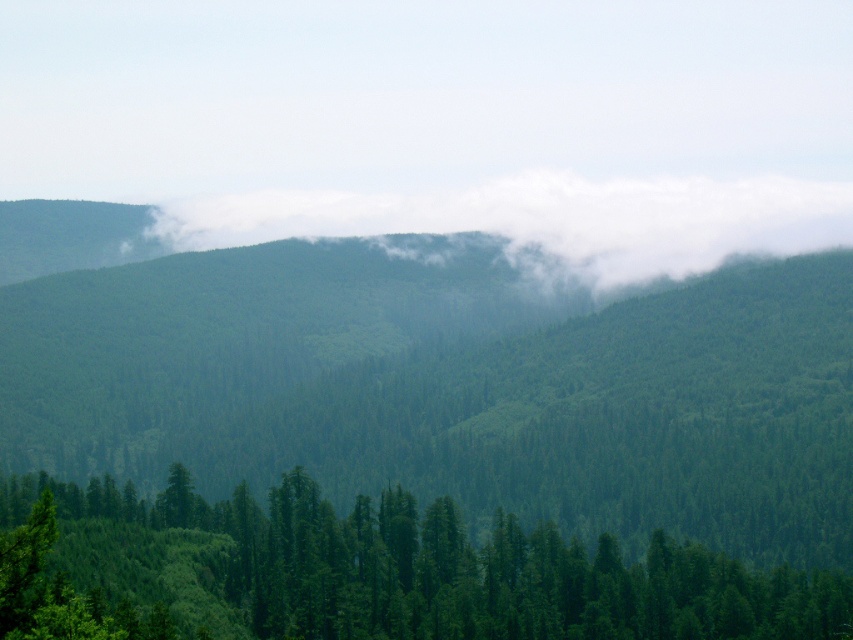
What is located at the coordinates point (367, 572) in the image?

The green matte tree at lower left is located at point (367, 572).

You are a hiker trying to navigate through the dense forest. You notice the green matte tree at lower left and the white fluffy cloud at center. Which object takes up more visual space in the image?

The white fluffy cloud at center takes up more visual space than the green matte tree at lower left.